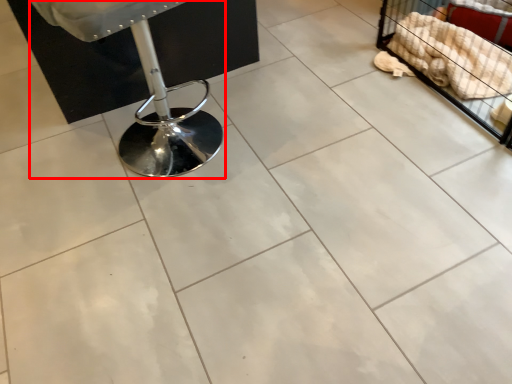
Question: In this image, where is swivel chair (annotated by the red box) located relative to furniture?

Choices:
 (A) right
 (B) left

Answer: (B)